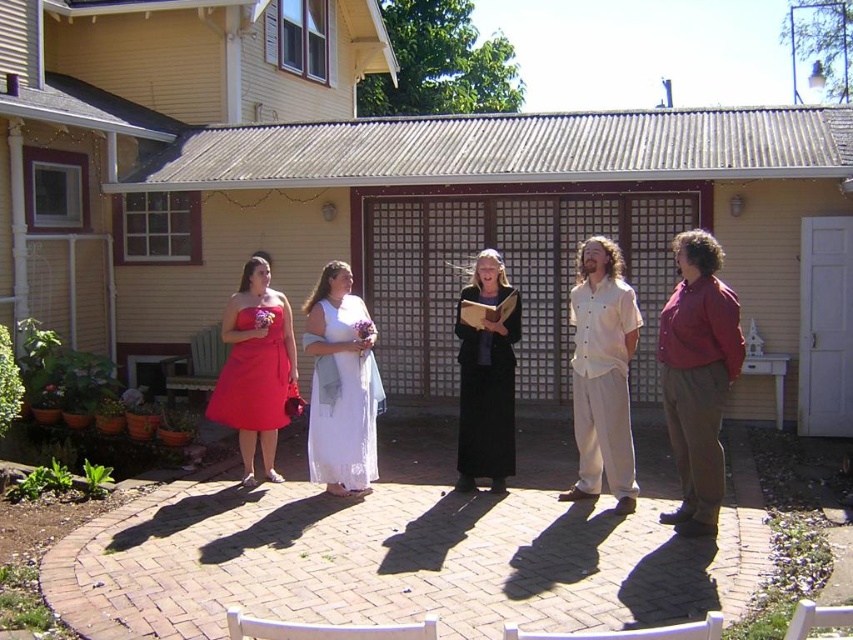
Question: Can you confirm if light beige cotton shirt at center is thinner than matte red dress at center?

Choices:
 (A) no
 (B) yes

Answer: (B)

Question: Which of the following is the farthest from the observer?

Choices:
 (A) (346, 376)
 (B) (476, 301)
 (C) (674, 429)

Answer: (B)

Question: Can you confirm if red cotton shirt at center is positioned above white lace dress at center?

Choices:
 (A) no
 (B) yes

Answer: (B)

Question: Considering the real-world distances, which object is closest to the white lace dress at center?

Choices:
 (A) black silk dress at center
 (B) red cotton shirt at center
 (C) matte red dress at center
 (D) light beige cotton shirt at center

Answer: (C)

Question: Considering the relative positions of light beige cotton shirt at center and matte red dress at center in the image provided, where is light beige cotton shirt at center located with respect to matte red dress at center?

Choices:
 (A) above
 (B) below

Answer: (B)

Question: Among these points, which one is nearest to the camera?

Choices:
 (A) (276, 374)
 (B) (492, 388)
 (C) (695, 516)

Answer: (C)